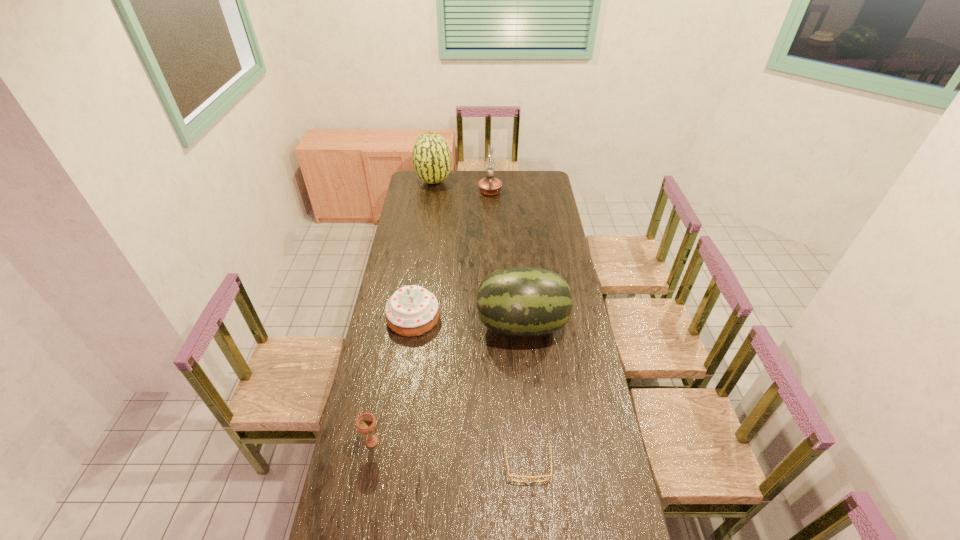
Find the location of `vacant point at the left edge`. vacant point at the left edge is located at coordinates (403, 240).

In the image, there is a desktop. Find the location of `vacant space at the right edge`. vacant space at the right edge is located at coordinates (539, 251).

The width and height of the screenshot is (960, 540). In the image, there is a desktop. Find the location of `vacant region at the far right corner`. vacant region at the far right corner is located at coordinates (540, 173).

Where is `vacant region between the right watermelon and the chalice`? vacant region between the right watermelon and the chalice is located at coordinates (447, 383).

Identify the location of vacant space in between the cake and the chalice. (393, 380).

Find the location of a particular element. This screenshot has height=540, width=960. unoccupied position between the cake and the oil lamp is located at coordinates (451, 254).

This screenshot has height=540, width=960. What are the coordinates of `vacant area between the nearer watermelon and the cake` in the screenshot? It's located at (468, 321).

Where is `vacant space that's between the nearer watermelon and the left watermelon`? The width and height of the screenshot is (960, 540). vacant space that's between the nearer watermelon and the left watermelon is located at coordinates (478, 253).

Where is `free space between the farther watermelon and the cake`? Image resolution: width=960 pixels, height=540 pixels. free space between the farther watermelon and the cake is located at coordinates (423, 249).

You are a GUI agent. You are given a task and a screenshot of the screen. Output one action in this format:
    pyautogui.click(x=<x>, y=<y>)
    Task: Click on the free space between the shortest object and the chalice
    The height and width of the screenshot is (540, 960).
    Given the screenshot: What is the action you would take?
    pyautogui.click(x=450, y=453)